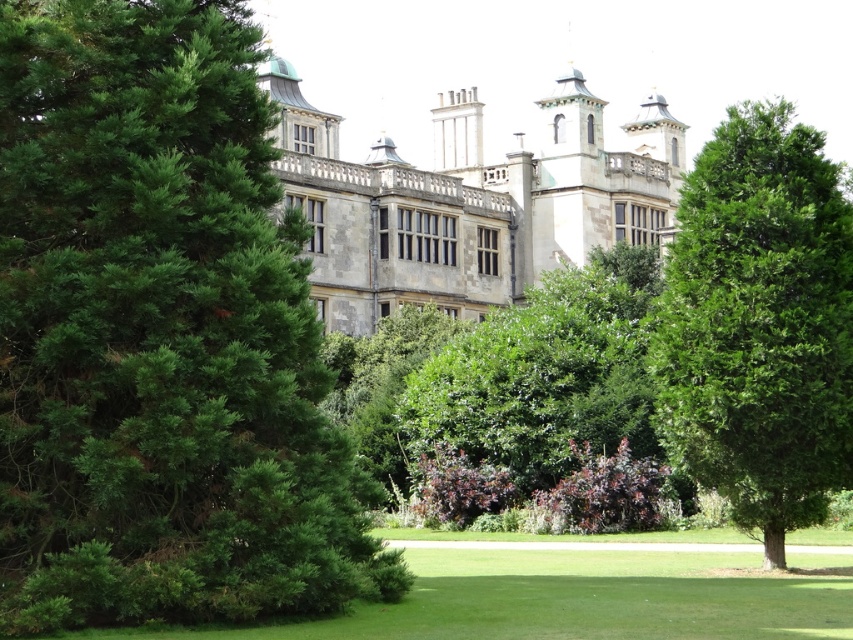
The image size is (853, 640). What do you see at coordinates (759, 324) in the screenshot?
I see `green leafy tree at center` at bounding box center [759, 324].

Does green leafy tree at center have a smaller size compared to green leafy bush at lower left?

No.

Which is behind, point (833, 424) or point (695, 538)?

The point (695, 538) is more distant.

I want to click on green leafy tree at center, so click(x=759, y=324).

Consider the image. Can you confirm if green textured tree at left is positioned to the left of green leafy tree at center?

Yes, green textured tree at left is to the left of green leafy tree at center.

Consider the image. Is green textured tree at left taller than green leafy tree at center?

Yes, green textured tree at left is taller than green leafy tree at center.

Identify the location of green textured tree at left. (160, 337).

The height and width of the screenshot is (640, 853). What do you see at coordinates (160, 337) in the screenshot? I see `green textured tree at left` at bounding box center [160, 337].

Can you confirm if green textured tree at left is bigger than green leafy bush at center?

No.

Locate an element on the screen. The height and width of the screenshot is (640, 853). green textured tree at left is located at coordinates point(160,337).